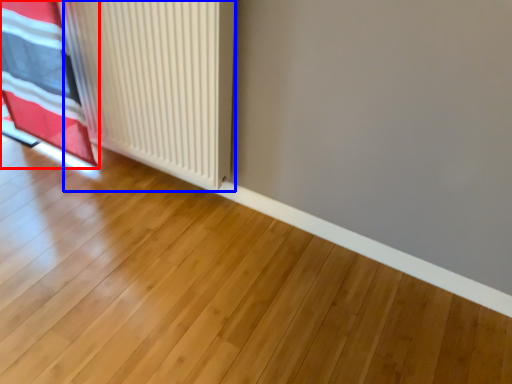
Question: Which object appears closest to the camera in this image, curtain (highlighted by a red box) or radiator (highlighted by a blue box)?

Choices:
 (A) curtain
 (B) radiator

Answer: (B)